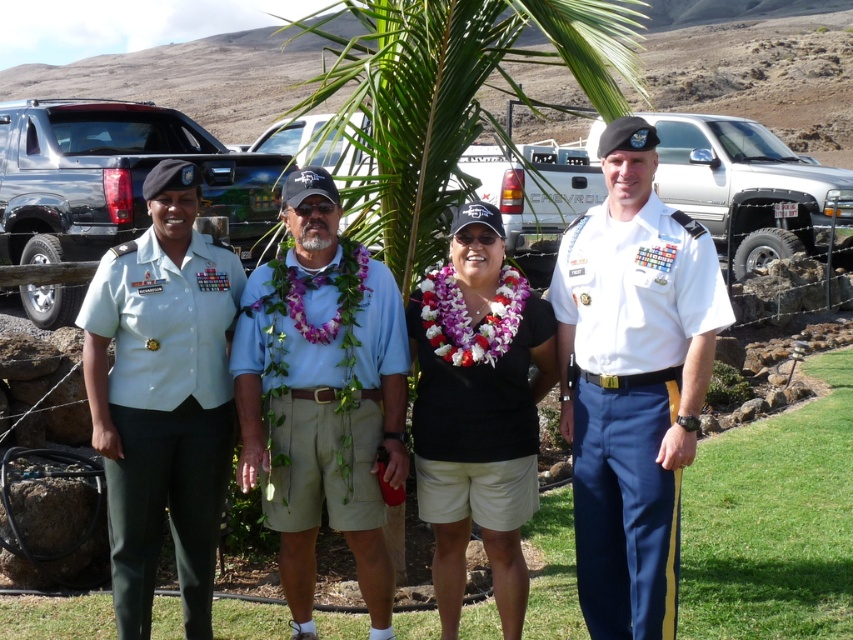
Is blue cotton shirt at center shorter than white cotton shirt at center?

No, blue cotton shirt at center is not shorter than white cotton shirt at center.

Which of these two, blue cotton shirt at center or white cotton shirt at center, stands shorter?

white cotton shirt at center

The width and height of the screenshot is (853, 640). In order to click on blue cotton shirt at center in this screenshot , I will do `click(322, 396)`.

The height and width of the screenshot is (640, 853). Find the location of `blue cotton shirt at center`. blue cotton shirt at center is located at coordinates (322, 396).

Who is shorter, light blue fabric uniform at left or black fabric lei at center?

Standing shorter between the two is light blue fabric uniform at left.

Can you confirm if light blue fabric uniform at left is taller than black fabric lei at center?

Incorrect, light blue fabric uniform at left's height is not larger of black fabric lei at center's.

Who is more distant from viewer, (218,344) or (517,532)?

Point (218,344)

Where is `light blue fabric uniform at left`? light blue fabric uniform at left is located at coordinates (163, 413).

You are a GUI agent. You are given a task and a screenshot of the screen. Output one action in this format:
    pyautogui.click(x=<x>, y=<y>)
    Task: Click on the white cotton shirt at center
    
    Given the screenshot: What is the action you would take?
    pyautogui.click(x=630, y=403)

In the scene shown: Is white cotton shirt at center taller than light blue fabric uniform at left?

Yes.

Describe the element at coordinates (630, 403) in the screenshot. I see `white cotton shirt at center` at that location.

You are a GUI agent. You are given a task and a screenshot of the screen. Output one action in this format:
    pyautogui.click(x=<x>, y=<y>)
    Task: Click on the white cotton shirt at center
    The height and width of the screenshot is (640, 853).
    Given the screenshot: What is the action you would take?
    pyautogui.click(x=630, y=403)